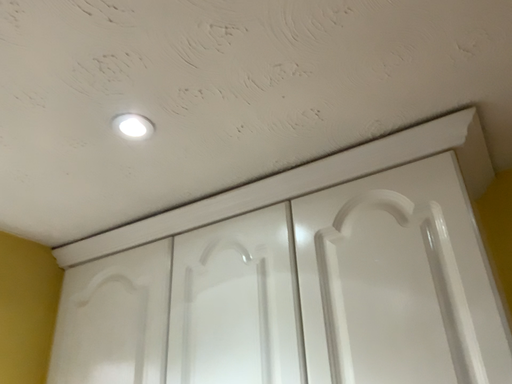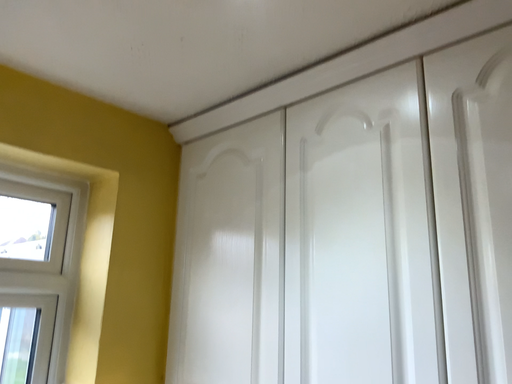
Question: How did the camera likely rotate when shooting the video?

Choices:
 (A) rotated upward
 (B) rotated downward

Answer: (B)